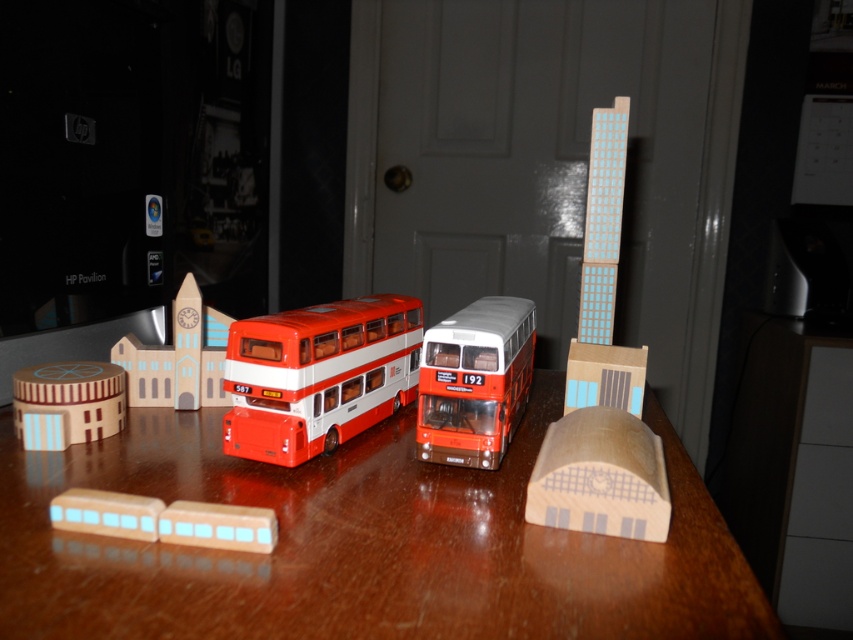
You are a delivery person who needs to place a new miniature bus exactly at the center of the wooden table. The current setup has a matte red and white double decker bus at center marked by point (318, 376). Will placing the new bus at this point interfere with the existing bus?

The matte red and white double decker bus at center is already located at point (318, 376), so placing the new bus at this exact point would directly interfere with the existing bus.

You are a child who wants to place the wooden building at left on top of the matte red bus at center for a pretend game. Based on their sizes, do you think this is possible?

The matte red bus at center is larger in size than wooden building at left, so yes, the wooden building at left can be placed on top of the matte red bus at center since it is smaller.

Based on the scene description, where is the matte red bus at center located in terms of its 2D coordinates?

The matte red bus at center is located at the 2D coordinates point (x=474, y=381).